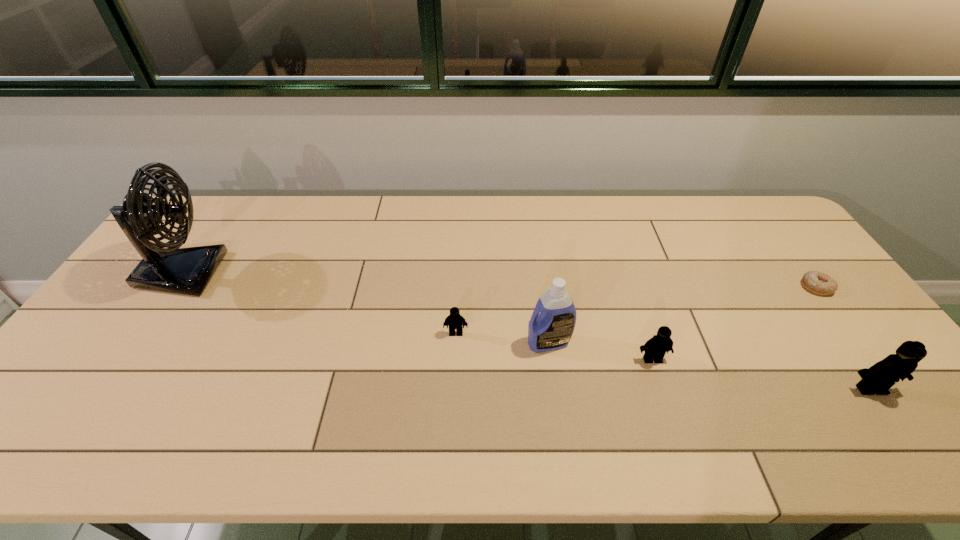
Where is `the third object from left to right`? The image size is (960, 540). the third object from left to right is located at coordinates (552, 329).

Locate an element on the screen. The image size is (960, 540). blank area located 0.120m on the face of the leftmost Lego is located at coordinates (454, 375).

Where is `free space located on the face of the second Lego from left to right`? Image resolution: width=960 pixels, height=540 pixels. free space located on the face of the second Lego from left to right is located at coordinates (662, 389).

Where is `vacant region located on the front of the doughnut`? vacant region located on the front of the doughnut is located at coordinates (846, 327).

Where is `vacant space situated 0.070m in front of the tallest object to blow air`? The image size is (960, 540). vacant space situated 0.070m in front of the tallest object to blow air is located at coordinates click(244, 273).

Where is `vacant space located 0.270m on the back of the third object from left to right`? The height and width of the screenshot is (540, 960). vacant space located 0.270m on the back of the third object from left to right is located at coordinates (538, 264).

The width and height of the screenshot is (960, 540). What are the coordinates of `object at the near edge` in the screenshot? It's located at (878, 379).

Where is `object at the left edge`? This screenshot has height=540, width=960. object at the left edge is located at coordinates (172, 269).

The width and height of the screenshot is (960, 540). What are the coordinates of `Lego positioned at the right edge` in the screenshot? It's located at (878, 379).

At what (x,y) coordinates should I click in order to perform the action: click on doughnut positioned at the right edge. Please return your answer as a coordinate pair (x, y). The image size is (960, 540). Looking at the image, I should click on (816, 282).